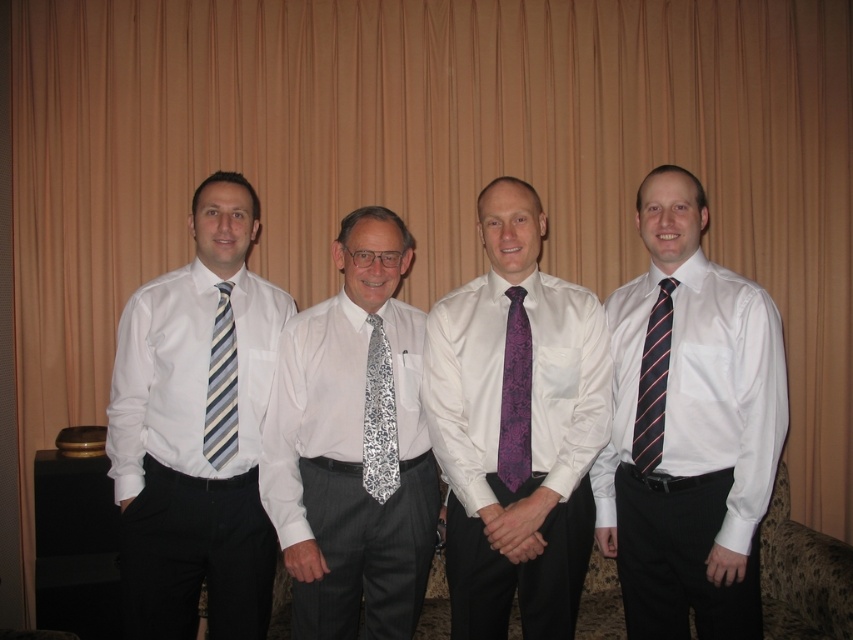
You are standing in front of the group of men and want to determine which of the two points, point (364, 317) or point (500, 449), is closer to you. Based on the scene description, which point is nearer?

Point (364, 317) is closer to you because it is further to the viewer than point (500, 449).

You are a photographer setting up for a group photo. You need to ensure that the white silk shirt at center and the purple floral tie at center are both visible in the frame. Based on their positions, which one should you focus on first to ensure both are in the shot?

The white silk shirt at center is to the left of purple floral tie at center, so focusing on the purple floral tie at center first would ensure both are included in the frame since the shirt is positioned to the left of the tie.